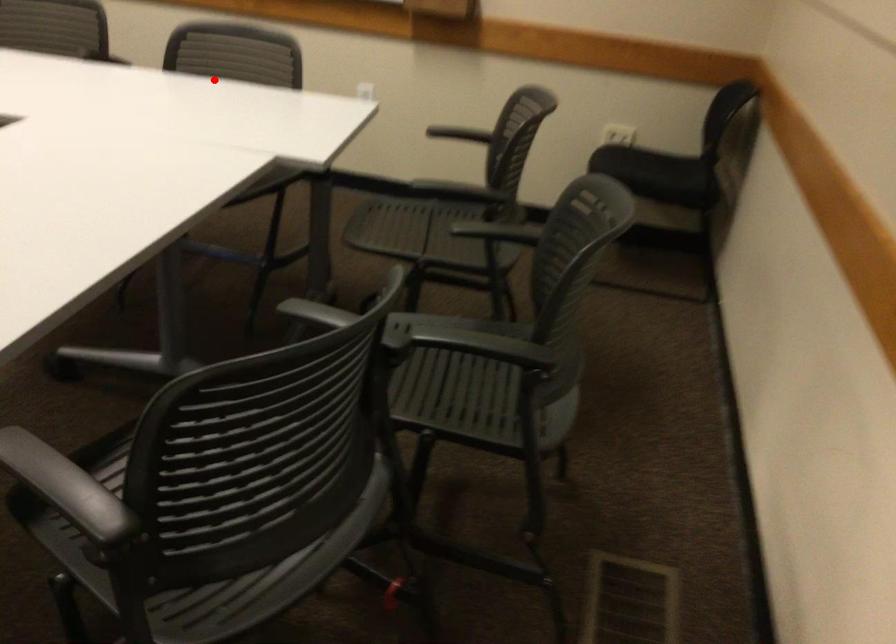
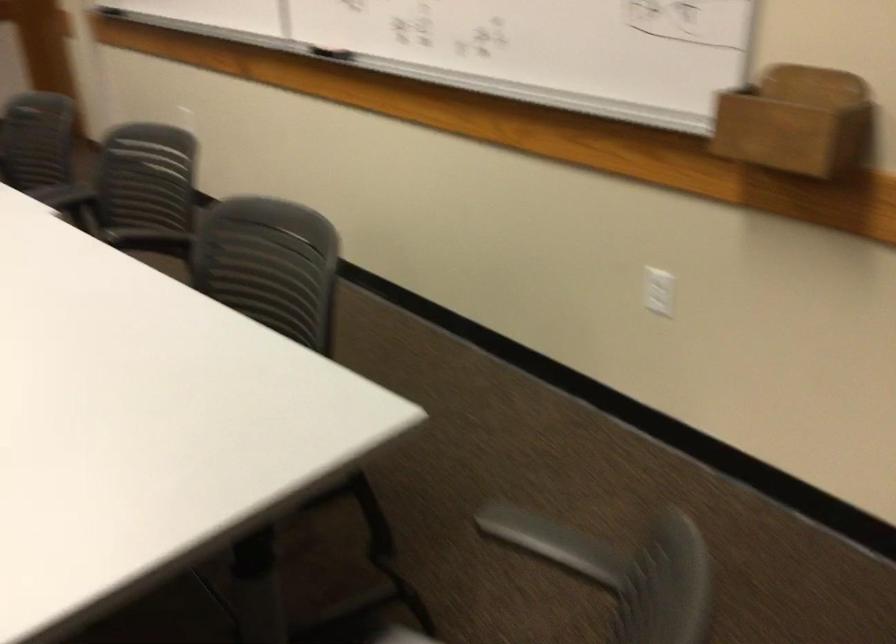
Question: A red point is marked in image1. In image2, is the corresponding 3D point closer to the camera or farther? Reply with the corresponding letter.

Choices:
 (A) The corresponding 3D point is closer.
 (B) The corresponding 3D point is farther.

Answer: (A)